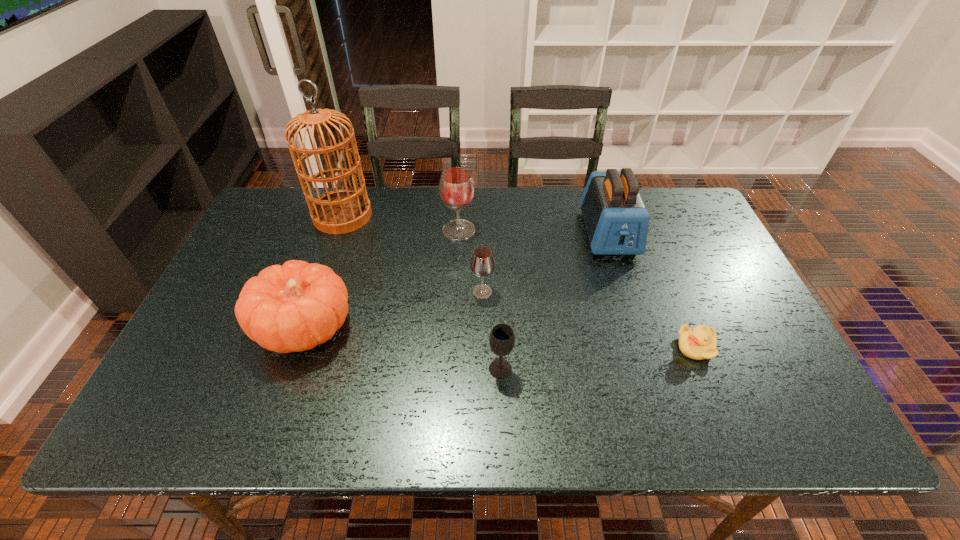
Locate an element on the screen. The width and height of the screenshot is (960, 540). object located in the left edge section of the desktop is located at coordinates (295, 307).

The image size is (960, 540). Find the location of `object present at the right edge`. object present at the right edge is located at coordinates 700,342.

Find the location of a particular element. vacant space at the far edge of the desktop is located at coordinates (412, 191).

At what (x,y) coordinates should I click in order to perform the action: click on free space at the near edge of the desktop. Please return your answer as a coordinate pair (x, y). Looking at the image, I should click on (715, 426).

Where is `vacant space at the left edge of the desktop`? The image size is (960, 540). vacant space at the left edge of the desktop is located at coordinates (258, 236).

The height and width of the screenshot is (540, 960). In order to click on vacant space at the right edge of the desktop in this screenshot , I will do `click(719, 259)`.

Where is `free point at the far left corner`? The width and height of the screenshot is (960, 540). free point at the far left corner is located at coordinates (262, 228).

In the image, there is a desktop. Where is `vacant area at the far right corner`? The width and height of the screenshot is (960, 540). vacant area at the far right corner is located at coordinates (674, 201).

Locate an element on the screen. This screenshot has height=540, width=960. empty location between the second farthest wineglass and the pumpkin is located at coordinates (394, 310).

Where is `empty space that is in between the nearest wineglass and the second object from right to left`? This screenshot has height=540, width=960. empty space that is in between the nearest wineglass and the second object from right to left is located at coordinates (554, 301).